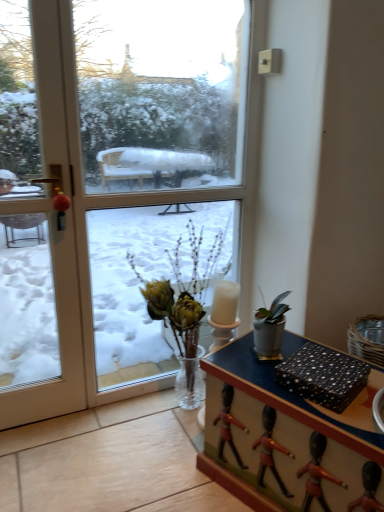
Question: From the image's perspective, relative to translucent glass vase at center, is transparent glass window at center above or below?

Choices:
 (A) above
 (B) below

Answer: (A)

Question: Based on their sizes in the image, would you say transparent glass window at center is bigger or smaller than translucent glass vase at center?

Choices:
 (A) big
 (B) small

Answer: (B)

Question: Considering the real-world distances, which object is closest to the translucent glass vase at center?

Choices:
 (A) transparent glass window at center
 (B) white glossy door at left
 (C) wooden desk at center
 (D) black dotted paper at lower right

Answer: (C)

Question: Which is farther from the white glossy door at left?

Choices:
 (A) black dotted paper at lower right
 (B) transparent glass window at center
 (C) translucent glass vase at center
 (D) wooden desk at center

Answer: (A)